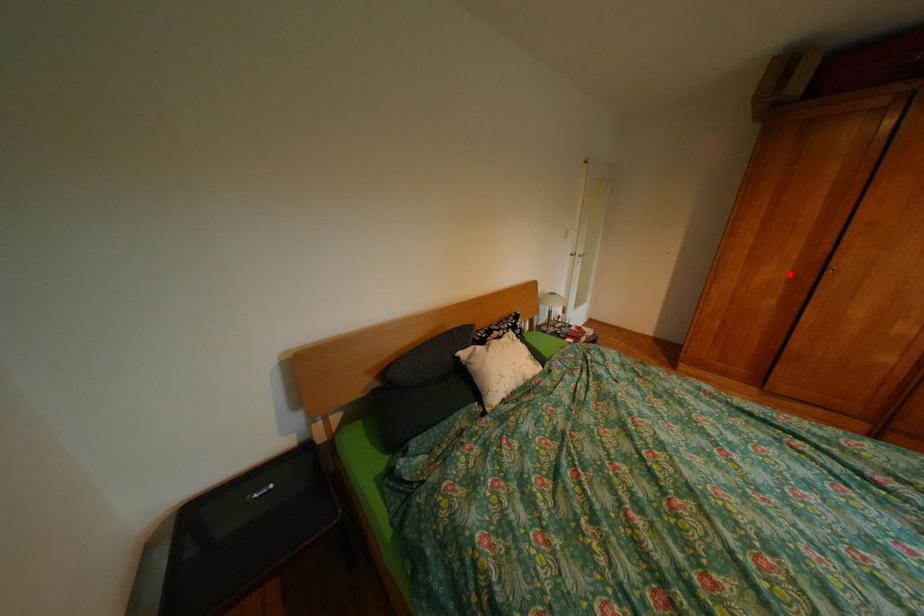
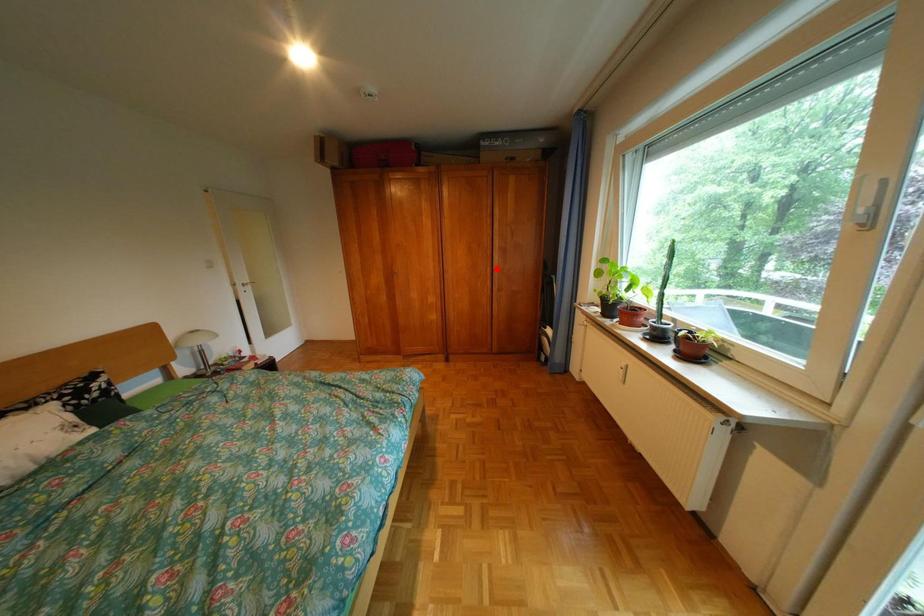
I am providing you with two images of the same scene from different viewpoints. A red point is marked on the first image and another point is marked on the second image. Are the points marked in image1 and image2 representing the same 3D position?

No